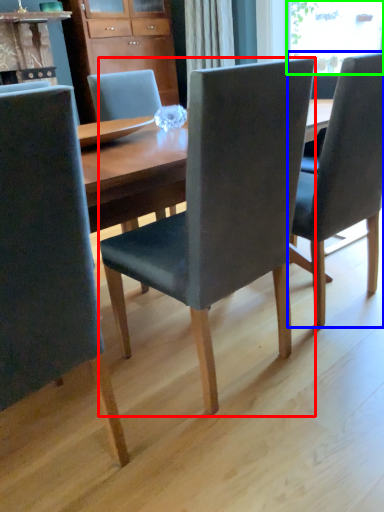
Question: Which object is positioned farthest from chair (highlighted by a red box)? Select from chair (highlighted by a blue box) and window screen (highlighted by a green box).

Choices:
 (A) chair
 (B) window screen

Answer: (B)